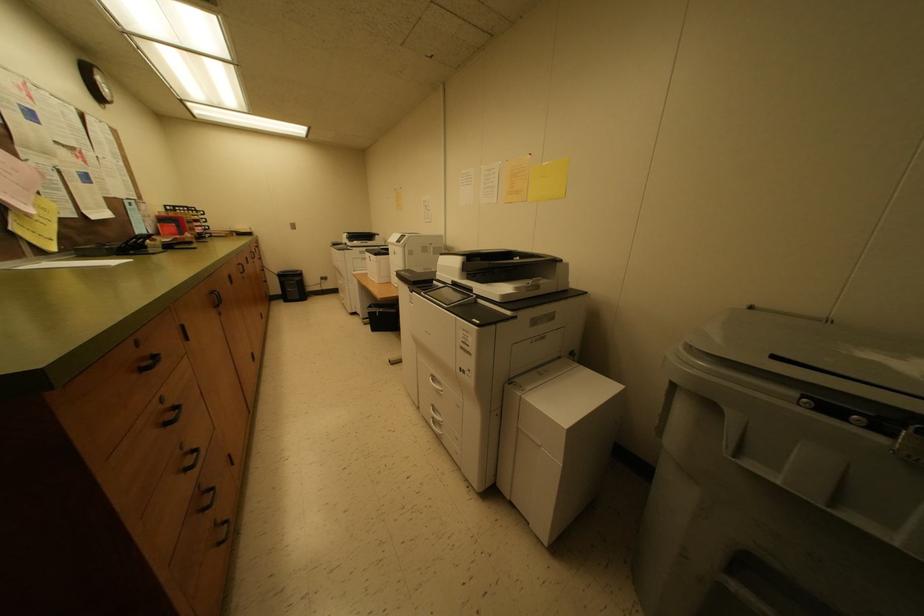
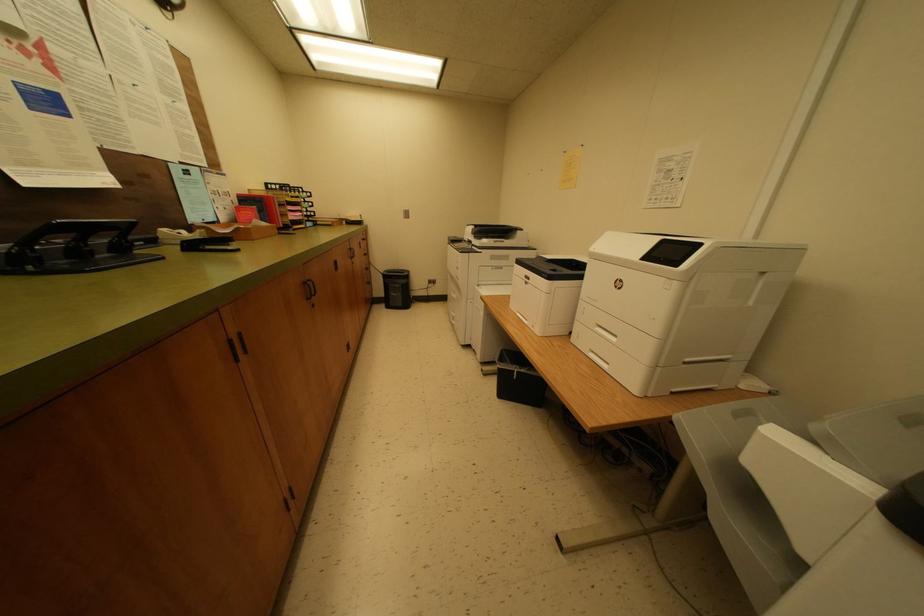
The images are taken continuously from a first-person perspective. In which direction are you moving?

The cameraman walked toward left, forward.